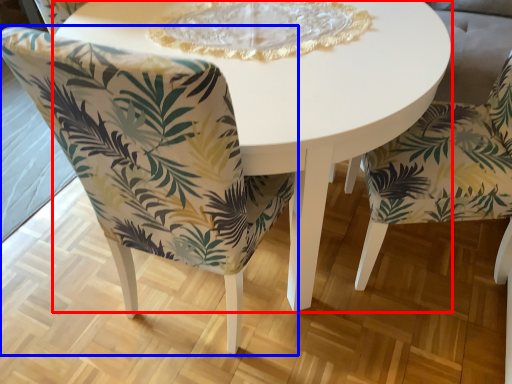
Question: Which point is further to the camera, coffee table (highlighted by a red box) or chair (highlighted by a blue box)?

Choices:
 (A) coffee table
 (B) chair

Answer: (A)